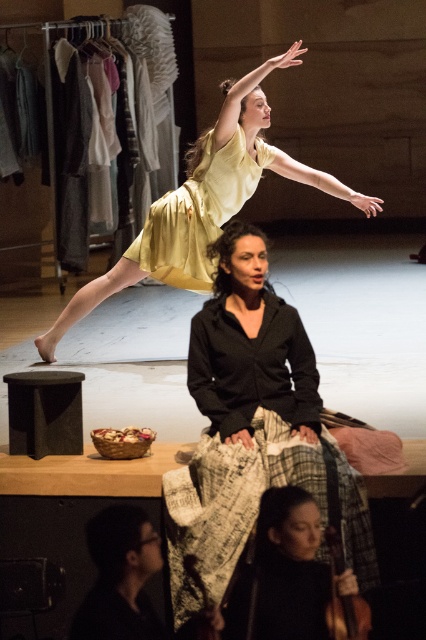
Is yellow satin dress at upper center taller than black glossy hair at upper center?

Indeed, yellow satin dress at upper center has a greater height compared to black glossy hair at upper center.

Locate an element on the screen. yellow satin dress at upper center is located at coordinates (198, 212).

You are a GUI agent. You are given a task and a screenshot of the screen. Output one action in this format:
    pyautogui.click(x=<x>, y=<y>)
    Task: Click on the yellow satin dress at upper center
    The image size is (426, 640).
    Given the screenshot: What is the action you would take?
    pyautogui.click(x=198, y=212)

Does matte yellow dress at upper center have a greater width compared to black glossy hair at upper center?

Yes.

Is matte yellow dress at upper center shorter than black glossy hair at upper center?

Incorrect, matte yellow dress at upper center's height does not fall short of black glossy hair at upper center's.

Does point (89, 282) come farther from viewer compared to point (140, 580)?

That is True.

The width and height of the screenshot is (426, 640). Find the location of `matte yellow dress at upper center`. matte yellow dress at upper center is located at coordinates (204, 200).

Is black textured skirt at center shorter than black glossy hair at upper center?

Incorrect, black textured skirt at center's height does not fall short of black glossy hair at upper center's.

Is black textured skirt at center below black glossy hair at upper center?

Incorrect, black textured skirt at center is not positioned below black glossy hair at upper center.

Who is more forward, (305, 451) or (146, 516)?

Positioned in front is point (305, 451).

Locate an element on the screen. The height and width of the screenshot is (640, 426). black textured skirt at center is located at coordinates (250, 429).